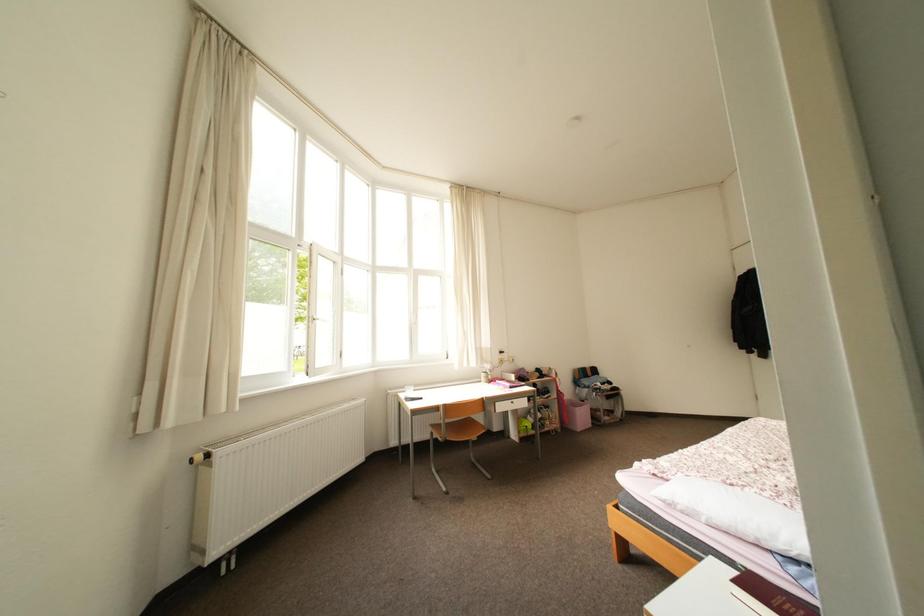
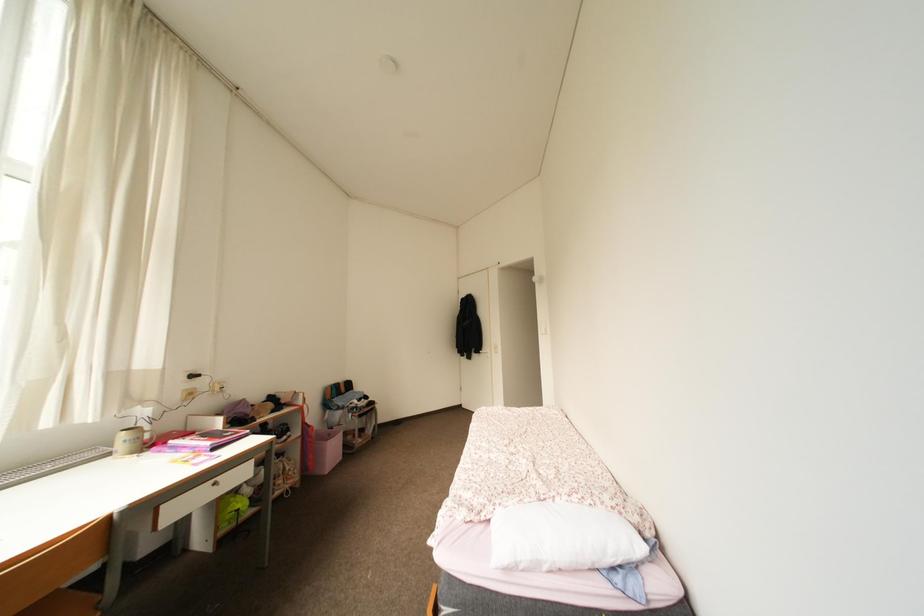
Question: The camera is either moving clockwise (left) or counter-clockwise (right) around the object. The first image is from the beginning of the video and the second image is from the end. Is the camera moving left or right when shooting the video?

Choices:
 (A) Left
 (B) Right

Answer: (A)